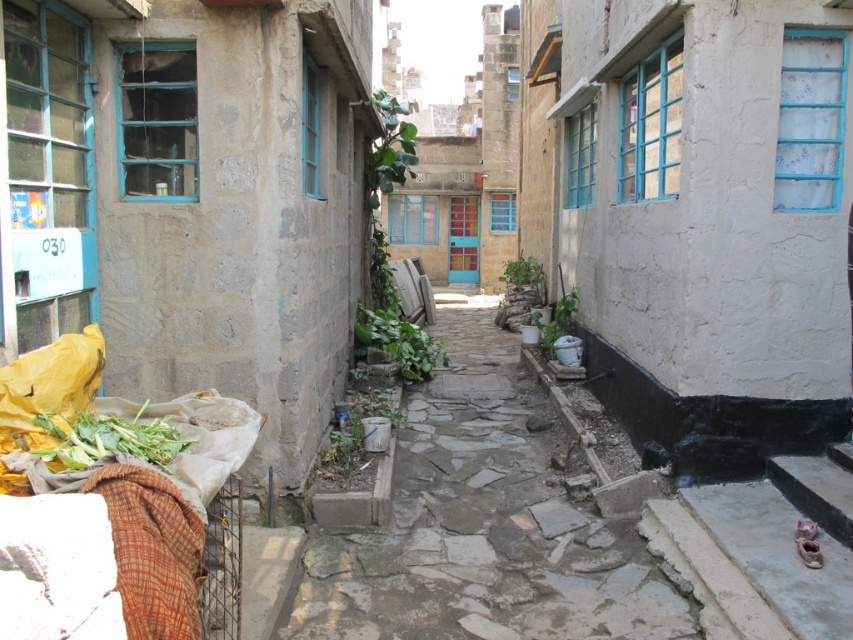
You are a delivery person trying to navigate through the narrow alleyway. You see a rusty metal planter at center and a green leafy plant at center. Which object is narrower in width?

The rusty metal planter at center is thinner than the green leafy plant at center, so the rusty metal planter at center is narrower in width.

You are a delivery person carrying a heavy box and need to navigate through the alleyway. There are green leafy vegetables at lower left and a green leafy plant at center. Can you safely pass between them without hitting the box against either?

The distance between the green leafy vegetables at lower left and the green leafy plant at center is 5.84 meters. Since the box is being carried by a person, the space is wide enough to pass safely between them without any collision.

You are a delivery person who needs to place a large box in the alley. You see the green leafy vegetables at lower left and the green leafy plant at center. Which area has more space to accommodate the box?

The green leafy plant at center has more space available since the green leafy vegetables at lower left occupy less space.